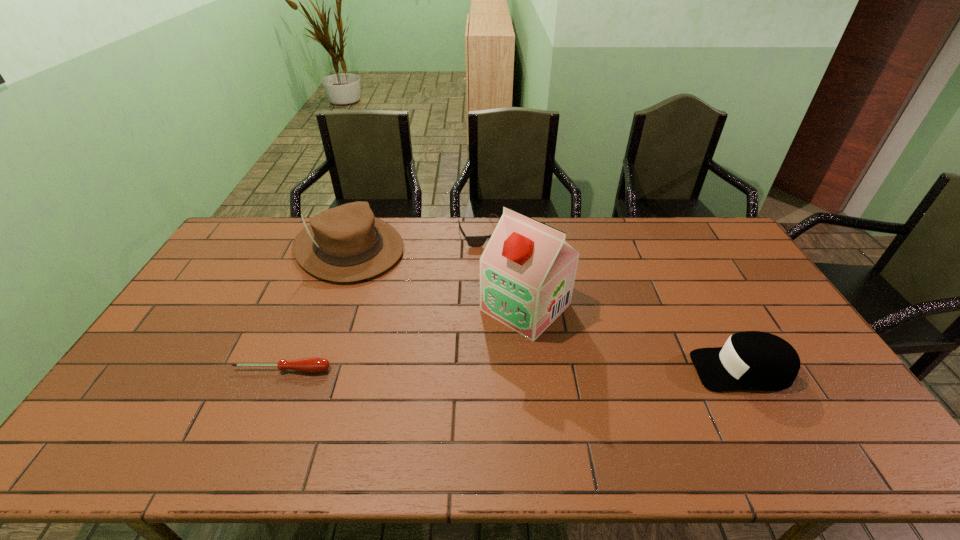
Where is `vacant space positioned 0.190m with the cap open on the tallest object`? The image size is (960, 540). vacant space positioned 0.190m with the cap open on the tallest object is located at coordinates (453, 373).

Where is `vacant space situated with the cap open on the tallest object`? The image size is (960, 540). vacant space situated with the cap open on the tallest object is located at coordinates (410, 413).

This screenshot has width=960, height=540. Identify the location of vacant region located with the cap open on the tallest object. (470, 357).

Where is `vacant space located on the feather side of the second tallest object`? This screenshot has height=540, width=960. vacant space located on the feather side of the second tallest object is located at coordinates (417, 307).

Identify the location of vacant space located on the feather side of the second tallest object. pos(447,333).

Where is `blank space located on the feather side of the second tallest object`? The width and height of the screenshot is (960, 540). blank space located on the feather side of the second tallest object is located at coordinates (432, 321).

Locate an element on the screen. The height and width of the screenshot is (540, 960). vacant space located 0.360m on the front-facing side of the sunglasses is located at coordinates (526, 315).

Where is `vacant position located on the front-facing side of the sunglasses`? This screenshot has width=960, height=540. vacant position located on the front-facing side of the sunglasses is located at coordinates (514, 292).

Locate an element on the screen. The image size is (960, 540). vacant space located on the front-facing side of the sunglasses is located at coordinates (516, 298).

Find the location of a particular element. The height and width of the screenshot is (540, 960). fedora present at the far edge is located at coordinates (346, 243).